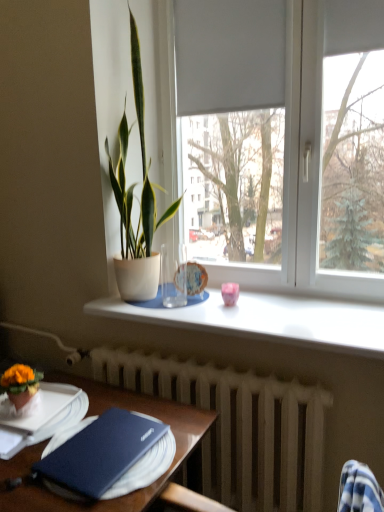
This screenshot has width=384, height=512. I want to click on vacant region to the left of porcelain plate at center, arranged as the second tableware when viewed from the right, so [158, 298].